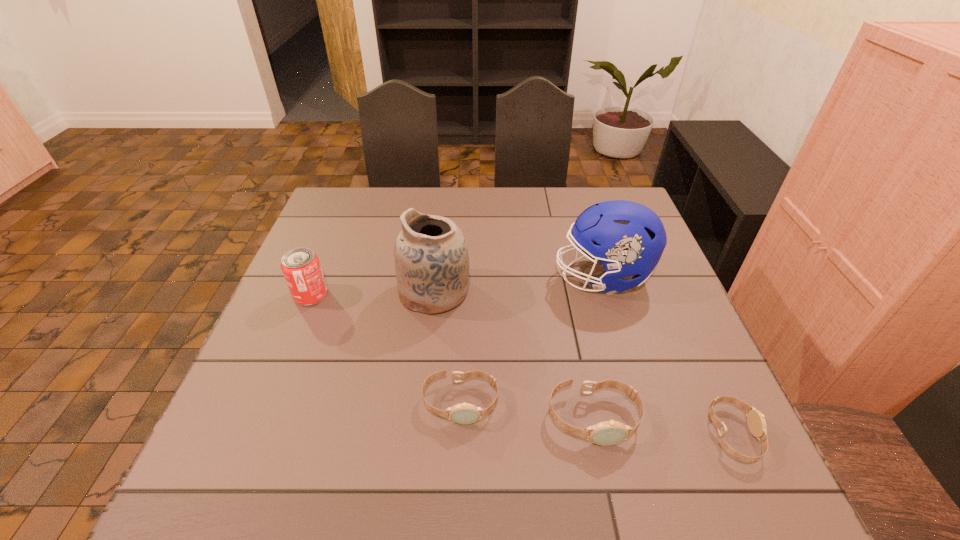
In the image, there is a desktop. Identify the location of vacant space at the left edge. pos(313,334).

In the image, there is a desktop. Identify the location of vacant space at the right edge. (670, 350).

This screenshot has width=960, height=540. I want to click on free space at the far left corner of the desktop, so click(372, 207).

Where is `vacant space at the near right corner`? The image size is (960, 540). vacant space at the near right corner is located at coordinates (705, 418).

The width and height of the screenshot is (960, 540). In order to click on vacant area that lies between the pottery and the second shortest watch in this screenshot , I will do `click(447, 347)`.

At what (x,y) coordinates should I click in order to perform the action: click on free area in between the leftmost watch and the pottery. Please return your answer as a coordinate pair (x, y). Image resolution: width=960 pixels, height=540 pixels. Looking at the image, I should click on (447, 347).

You are a GUI agent. You are given a task and a screenshot of the screen. Output one action in this format:
    pyautogui.click(x=<x>, y=<y>)
    Task: Click on the vacant space that's between the leftmost object and the shortest object
    
    Given the screenshot: What is the action you would take?
    pyautogui.click(x=522, y=365)

At what (x,y) coordinates should I click in order to perform the action: click on unoccupied position between the shortest watch and the second watch from right to left. Please return your answer as a coordinate pair (x, y). Looking at the image, I should click on (663, 426).

Identify the location of free space between the rightmost watch and the football helmet. This screenshot has height=540, width=960. (668, 355).

The height and width of the screenshot is (540, 960). I want to click on empty space that is in between the rightmost watch and the second shortest object, so click(597, 418).